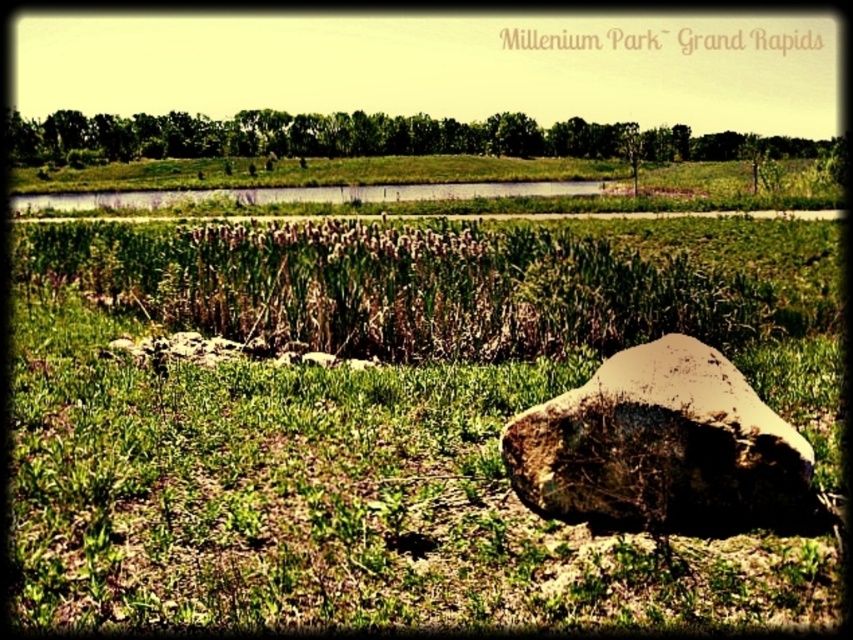
Looking at this image, can you confirm if green grassy at center is shorter than brown rough rock at center?

Incorrect, green grassy at center's height does not fall short of brown rough rock at center's.

Is green grassy at center in front of brown rough rock at center?

Yes, it is in front of brown rough rock at center.

Between point (112, 508) and point (701, 444), which one is positioned in front?

Point (701, 444) is more forward.

At what (x,y) coordinates should I click in order to perform the action: click on green grassy at center. Please return your answer as a coordinate pair (x, y). This screenshot has width=853, height=640. Looking at the image, I should click on (366, 428).